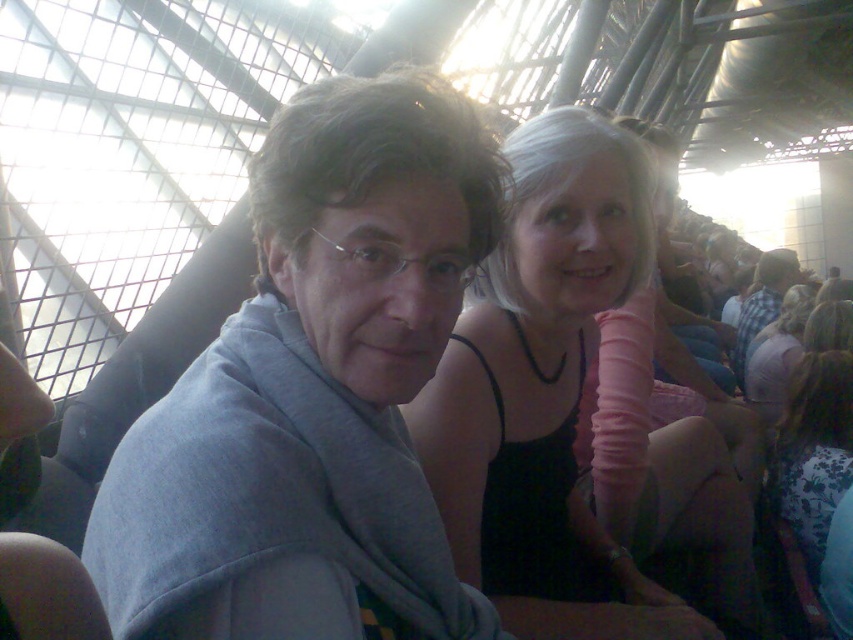
Can you confirm if black matte tank top at center is shorter than plaid shirt at center?

Incorrect, black matte tank top at center's height does not fall short of plaid shirt at center's.

Which of these two, black matte tank top at center or plaid shirt at center, stands shorter?

With less height is plaid shirt at center.

Find the location of a particular element. This screenshot has height=640, width=853. black matte tank top at center is located at coordinates (543, 388).

Can you confirm if black matte tank top at center is positioned to the left of floral dress at lower right?

Correct, you'll find black matte tank top at center to the left of floral dress at lower right.

Is point (430, 412) more distant than point (817, 529)?

No, it is in front of (817, 529).

Where is `black matte tank top at center`? The image size is (853, 640). black matte tank top at center is located at coordinates tap(543, 388).

Is black matte tank top at center to the right of pink fabric dress at center from the viewer's perspective?

In fact, black matte tank top at center is to the left of pink fabric dress at center.

Can you confirm if black matte tank top at center is taller than pink fabric dress at center?

Yes.

Is point (556, 467) closer to camera compared to point (778, 394)?

Yes, it is.

Image resolution: width=853 pixels, height=640 pixels. Find the location of `black matte tank top at center`. black matte tank top at center is located at coordinates (543, 388).